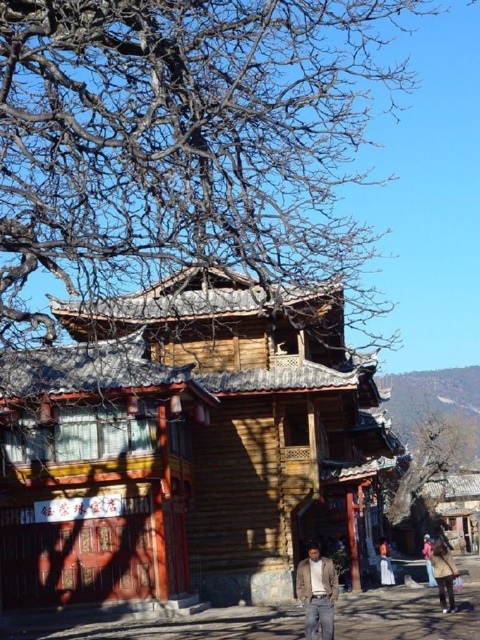
Question: Which object appears farthest from the camera in this image?

Choices:
 (A) khaki fabric jacket at lower right
 (B) wooden hut at center
 (C) khaki cotton pants at lower center

Answer: (B)

Question: Can you confirm if khaki cotton pants at lower center is bigger than khaki fabric jacket at lower right?

Choices:
 (A) no
 (B) yes

Answer: (A)

Question: Among these points, which one is nearest to the camera?

Choices:
 (A) [317, 579]
 (B) [427, 541]
 (C) [437, 586]

Answer: (A)

Question: Does wooden hut at center have a smaller size compared to orange fabric at lower right?

Choices:
 (A) yes
 (B) no

Answer: (B)

Question: Which of the following is the farthest from the observer?

Choices:
 (A) khaki fabric jacket at lower right
 (B) wooden hut at center

Answer: (B)

Question: Is khaki cotton pants at lower center positioned behind khaki fabric jacket at lower right?

Choices:
 (A) yes
 (B) no

Answer: (B)